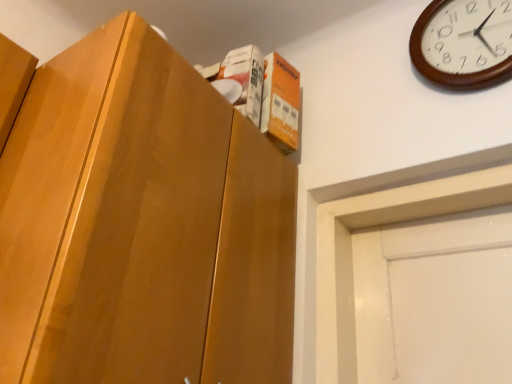
Question: Relative to matte wood cabinet at upper left, is wooden clock at upper right in front or behind?

Choices:
 (A) behind
 (B) front

Answer: (A)

Question: From a real-world perspective, is wooden clock at upper right physically located above or below matte wood cabinet at upper left?

Choices:
 (A) above
 (B) below

Answer: (A)

Question: Would you say wooden clock at upper right is to the left or to the right of matte wood cabinet at upper left in the picture?

Choices:
 (A) right
 (B) left

Answer: (A)

Question: Which is correct: matte wood cabinet at upper left is inside wooden clock at upper right, or outside of it?

Choices:
 (A) inside
 (B) outside

Answer: (B)

Question: Is point (129, 253) closer or farther from the camera than point (417, 52)?

Choices:
 (A) closer
 (B) farther

Answer: (A)

Question: Considering the positions of matte wood cabinet at upper left and wooden clock at upper right in the image, is matte wood cabinet at upper left taller or shorter than wooden clock at upper right?

Choices:
 (A) short
 (B) tall

Answer: (B)

Question: From the image's perspective, relative to wooden clock at upper right, is matte wood cabinet at upper left above or below?

Choices:
 (A) below
 (B) above

Answer: (A)